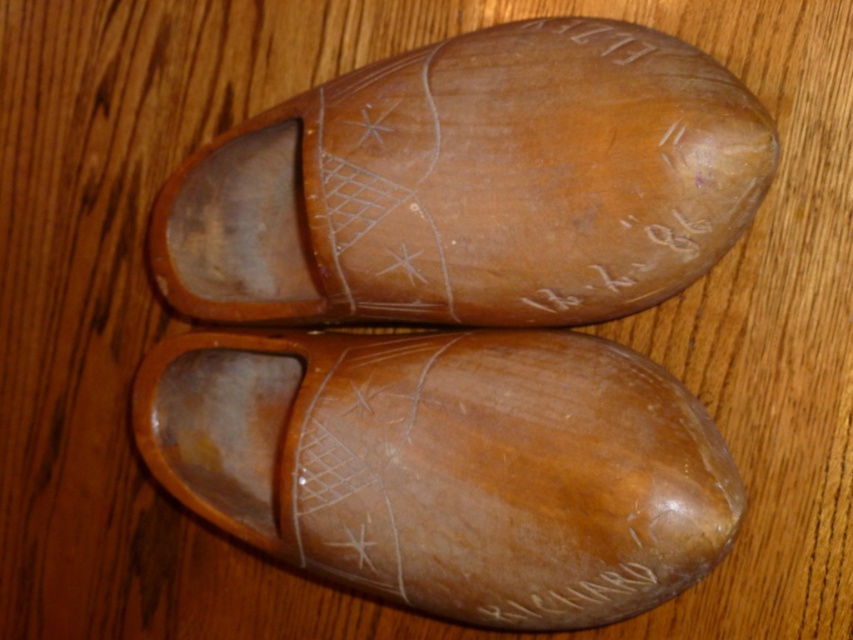
You are trying to stack two wooden shoes for storage. The matte brown wooden shoe at center and the light brown wood shoe at center are both on the same wooden surface. Which one is already placed on top of the other?

The matte brown wooden shoe at center is positioned over light brown wood shoe at center, so the matte brown wooden shoe at center is already on top of the light brown wood shoe at center.

You are a shoemaker who needs to package these two shoes into a box that is 8 inches wide. Can you fit both the matte brown wooden shoe at center and the light brown wood shoe at center side by side in the box?

The matte brown wooden shoe at center and light brown wood shoe at center are 7.99 inches apart from each other. Since the box is 8 inches wide, there is just enough space to fit both shoes side by side with minimal clearance.